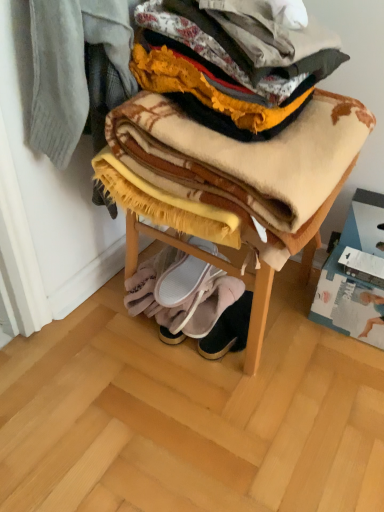
Find the location of `empty space that is to the right of soft yellow fleece blanket at lower center, the 2th blanket positioned from the front`. empty space that is to the right of soft yellow fleece blanket at lower center, the 2th blanket positioned from the front is located at coordinates click(x=287, y=314).